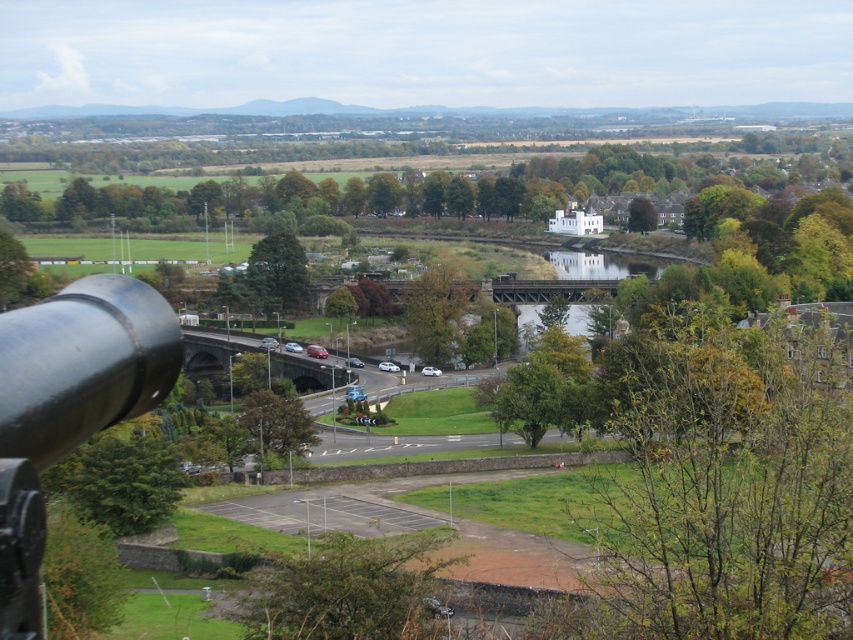
Question: Among these objects, which one is nearest to the camera?

Choices:
 (A) green leafy tree at center
 (B) green leafy tree at center-right

Answer: (A)

Question: Can you confirm if green leafy tree at lower left is positioned below green matte tree at center?

Choices:
 (A) yes
 (B) no

Answer: (A)

Question: Which object is the farthest from the green leafy tree at lower left?

Choices:
 (A) green leafy tree at lower right
 (B) green leafy tree at lower center
 (C) green matte tree at center

Answer: (C)

Question: Is green leafy tree at lower left positioned at the back of green leafy tree at center?

Choices:
 (A) yes
 (B) no

Answer: (B)

Question: Which point is farther to the camera?

Choices:
 (A) 650,209
 (B) 271,400

Answer: (A)

Question: Can you confirm if polished metal cannon at left is thinner than green matte tree at center?

Choices:
 (A) no
 (B) yes

Answer: (B)